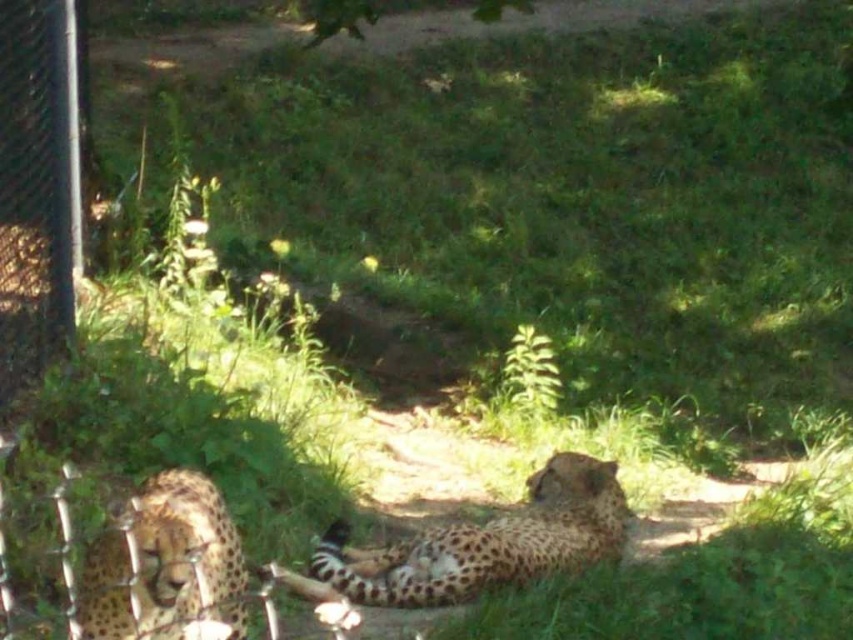
You are a zookeeper trying to feed the spotted fur cheetah at center and the spotted fur cheetah at lower left. If you stand at the entrance which is at the upper right corner of the enclosure, which cheetah will you see first when looking towards the center?

The spotted fur cheetah at lower left will be seen first because it is positioned to the left of the spotted fur cheetah at center, so when approaching from the upper right, the leftmost cheetah would come into view first.

You are a zookeeper planning to feed both spotted fur cheetah at center and spotted fur cheetah at lower left. You have a food tray that can hold up to 3 kilograms of meat. If the larger cheetah requires twice the amount of meat than the smaller one, how much meat should you allocate to each?

The spotted fur cheetah at center is larger and requires twice the amount of meat compared to the spotted fur cheetah at lower left. Let the smaller cheetah receive x kilograms. Then the larger would get 2x. Total is x 2x 3x. 3x equals 3 kg. So x is 1 kg. Therefore, spotted fur cheetah at lower left gets 1 kg and spotted fur cheetah at center gets 2 kg.